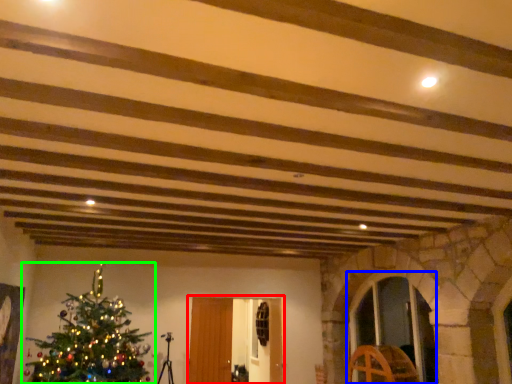
Question: Estimate the real-world distances between objects in this image. Which object is closer to glass door (highlighted by a red box), glass door (highlighted by a blue box) or christmas tree (highlighted by a green box)?

Choices:
 (A) glass door
 (B) christmas tree

Answer: (B)